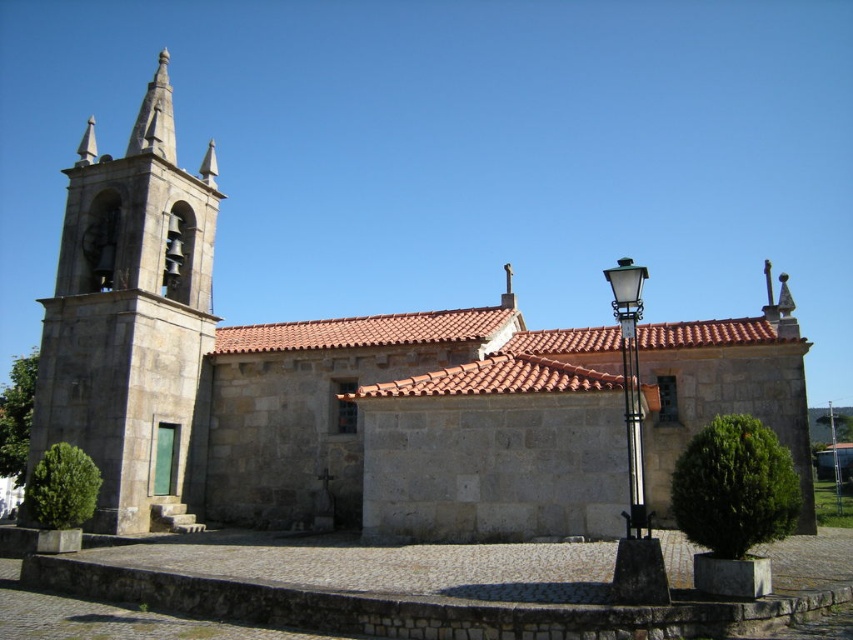
You are standing in front of the stone church at left and the stone bell tower at left. Which structure would cast a longer shadow during midday when the sun is directly overhead?

The stone church at left has a larger size compared to the stone bell tower at left, so it would cast a longer shadow during midday when the sun is directly overhead.

Looking at this image, you are standing in front of the stone church at left and the stone bell tower at left. Which structure is positioned lower in the image?

The stone church at left is positioned lower than the stone bell tower at left in the image.